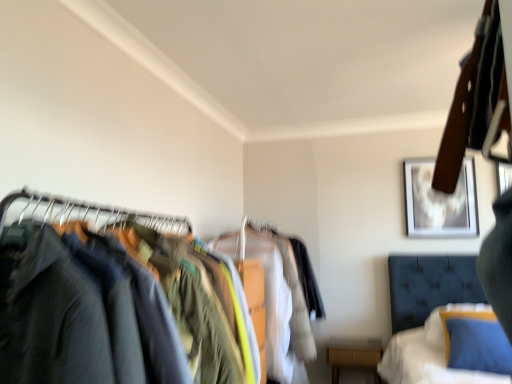
Where is `dark gray fabric at left, which is the second clothing from back to front`? Image resolution: width=512 pixels, height=384 pixels. dark gray fabric at left, which is the second clothing from back to front is located at coordinates (86, 317).

Where is `dark blue fabric at left`? This screenshot has height=384, width=512. dark blue fabric at left is located at coordinates (119, 300).

In the scene shown: Measure the distance between velvet blue bed at lower right and camera.

The depth of velvet blue bed at lower right is 2.08 meters.

Where is `metallic silver picture frame at upper right, the first picture frame viewed from the right`? The width and height of the screenshot is (512, 384). metallic silver picture frame at upper right, the first picture frame viewed from the right is located at coordinates (504, 177).

From a real-world perspective, who is located lower, metallic silver picture frame at upper right, positioned as the 2th picture frame in left-to-right order, or dark gray fabric at left, which is the 1th clothing in front-to-back order?

dark gray fabric at left, which is the 1th clothing in front-to-back order.

Considering the sizes of objects metallic silver picture frame at upper right, the first picture frame viewed from the right, and dark gray fabric at left, which is the second clothing from back to front, in the image provided, who is smaller, metallic silver picture frame at upper right, the first picture frame viewed from the right, or dark gray fabric at left, which is the second clothing from back to front,?

metallic silver picture frame at upper right, the first picture frame viewed from the right.

Is metallic silver picture frame at upper right, the first picture frame viewed from the right, positioned in front of dark gray fabric at left, which is the second clothing from back to front?

No.

Between metallic silver picture frame at upper right, the first picture frame viewed from the right, and dark gray fabric at left, which is the second clothing from back to front, which one appears on the right side from the viewer's perspective?

Positioned to the right is metallic silver picture frame at upper right, the first picture frame viewed from the right.

Is metallic silver picture frame at upper right, the first picture frame viewed from the right, facing towards white cotton shirt at center, the first clothing when ordered from back to front?

No, metallic silver picture frame at upper right, the first picture frame viewed from the right, is not facing towards white cotton shirt at center, the first clothing when ordered from back to front.

Which object is thinner, metallic silver picture frame at upper right, positioned as the 2th picture frame in left-to-right order, or white cotton shirt at center, the first clothing when ordered from back to front?

metallic silver picture frame at upper right, positioned as the 2th picture frame in left-to-right order, is thinner.

From the image's perspective, does metallic silver picture frame at upper right, the first picture frame viewed from the right, appear lower than white cotton shirt at center, acting as the 2th clothing starting from the front?

Actually, metallic silver picture frame at upper right, the first picture frame viewed from the right, appears above white cotton shirt at center, acting as the 2th clothing starting from the front, in the image.

Can you see metallic silver picture frame at upper right, positioned as the 2th picture frame in left-to-right order, touching white cotton shirt at center, acting as the 2th clothing starting from the front?

There is a gap between metallic silver picture frame at upper right, positioned as the 2th picture frame in left-to-right order, and white cotton shirt at center, acting as the 2th clothing starting from the front.

From the image's perspective, who appears lower, metallic silver picture frame at upper right, the first picture frame viewed from the right, or velvet blue bed at lower right?

velvet blue bed at lower right appears lower in the image.

This screenshot has height=384, width=512. What are the coordinates of `bed on the left of metallic silver picture frame at upper right, the first picture frame viewed from the right` in the screenshot? It's located at (426, 316).

Does metallic silver picture frame at upper right, the first picture frame viewed from the right, lie in front of velvet blue bed at lower right?

That is False.

Between metallic silver picture frame at upper right, the first picture frame viewed from the right, and velvet blue bed at lower right, which one has smaller width?

metallic silver picture frame at upper right, the first picture frame viewed from the right.

Could you measure the distance between velvet blue bed at lower right and white cotton shirt at center, acting as the 2th clothing starting from the front?

velvet blue bed at lower right and white cotton shirt at center, acting as the 2th clothing starting from the front, are 33.53 inches apart.

From the image's perspective, does velvet blue bed at lower right appear higher than white cotton shirt at center, acting as the 2th clothing starting from the front?

No.

Is point (386, 364) farther from viewer compared to point (249, 263)?

Yes, it is.

Which of these two, velvet blue bed at lower right or white cotton shirt at center, the first clothing when ordered from back to front, stands shorter?

Standing shorter between the two is velvet blue bed at lower right.

Is velvet blue bed at lower right in contact with dark gray fabric at left, which is the second clothing from back to front?

velvet blue bed at lower right is not next to dark gray fabric at left, which is the second clothing from back to front, and they're not touching.

Measure the distance between velvet blue bed at lower right and dark gray fabric at left, which is the second clothing from back to front.

The distance of velvet blue bed at lower right from dark gray fabric at left, which is the second clothing from back to front, is 6.40 feet.

From a real-world perspective, is velvet blue bed at lower right on top of dark gray fabric at left, which is the 1th clothing in front-to-back order?

No, from a real-world perspective, velvet blue bed at lower right is not over dark gray fabric at left, which is the 1th clothing in front-to-back order

In terms of size, does velvet blue bed at lower right appear bigger or smaller than dark gray fabric at left, which is the second clothing from back to front?

Clearly, velvet blue bed at lower right is larger in size than dark gray fabric at left, which is the second clothing from back to front.

From the image's perspective, relative to metallic silver picture frame at upper right, the first picture frame viewed from the right, is velvet blue bed at lower right above or below?

Based on their image positions, velvet blue bed at lower right is located beneath metallic silver picture frame at upper right, the first picture frame viewed from the right.

Would you say velvet blue bed at lower right is inside or outside metallic silver picture frame at upper right, positioned as the 2th picture frame in left-to-right order?

velvet blue bed at lower right is not inside metallic silver picture frame at upper right, positioned as the 2th picture frame in left-to-right order, it's outside.

Can you tell me how much velvet blue bed at lower right and metallic silver picture frame at upper right, the first picture frame viewed from the right, differ in facing direction?

There is a 3.01-degree angle between the facing directions of velvet blue bed at lower right and metallic silver picture frame at upper right, the first picture frame viewed from the right.

Considering the relative positions of velvet blue bed at lower right and metallic silver picture frame at upper right, positioned as the 2th picture frame in left-to-right order, in the image provided, is velvet blue bed at lower right to the left of metallic silver picture frame at upper right, positioned as the 2th picture frame in left-to-right order, from the viewer's perspective?

Yes.

Between dark blue fabric at left and velvet blue bed at lower right, which one appears on the left side from the viewer's perspective?

dark blue fabric at left is more to the left.

Based on the photo, measure the distance between dark blue fabric at left and velvet blue bed at lower right.

dark blue fabric at left is 4.06 feet away from velvet blue bed at lower right.

From a real-world perspective, is dark blue fabric at left positioned above or below velvet blue bed at lower right?

Clearly, from a real-world perspective, dark blue fabric at left is above velvet blue bed at lower right.

Based on the photo, could you tell me if dark blue fabric at left is facing velvet blue bed at lower right?

No, dark blue fabric at left is not turned towards velvet blue bed at lower right.

Find the location of a particular element. The width and height of the screenshot is (512, 384). the 2nd clothing to the left when counting from the metallic silver picture frame at upper right, the first picture frame viewed from the right is located at coordinates (86, 317).

Image resolution: width=512 pixels, height=384 pixels. Find the location of `clothing that is the 2nd object directly below the metallic silver picture frame at upper right, positioned as the 2th picture frame in left-to-right order (from a real-world perspective)`. clothing that is the 2nd object directly below the metallic silver picture frame at upper right, positioned as the 2th picture frame in left-to-right order (from a real-world perspective) is located at coordinates (274, 296).

Based on their spatial positions, is white cotton shirt at center, the first clothing when ordered from back to front, or dark gray fabric at left, which is the 1th clothing in front-to-back order, further from velvet blue bed at lower right?

dark gray fabric at left, which is the 1th clothing in front-to-back order, is positioned further to the anchor velvet blue bed at lower right.

Considering their positions, is velvet blue bed at lower right positioned further to white cotton shirt at center, acting as the 2th clothing starting from the front, than wooden framed artwork at upper right, which ranks as the 2th picture frame in right-to-left order?

Based on the image, wooden framed artwork at upper right, which ranks as the 2th picture frame in right-to-left order, appears to be further to white cotton shirt at center, acting as the 2th clothing starting from the front.

Considering their positions, is dark blue fabric at left positioned closer to metallic silver picture frame at upper right, the first picture frame viewed from the right, than dark gray fabric at left, which is the 1th clothing in front-to-back order?

Based on the image, dark gray fabric at left, which is the 1th clothing in front-to-back order, appears to be nearer to metallic silver picture frame at upper right, the first picture frame viewed from the right.

From the image, which object appears to be nearer to wooden framed artwork at upper right, marked as the 1th picture frame in a left-to-right arrangement, dark blue fabric at left or metallic silver picture frame at upper right, the first picture frame viewed from the right?

dark blue fabric at left.

Consider the image. Based on their spatial positions, is velvet blue bed at lower right or white cotton shirt at center, acting as the 2th clothing starting from the front, closer to dark blue fabric at left?

Based on the image, white cotton shirt at center, acting as the 2th clothing starting from the front, appears to be nearer to dark blue fabric at left.

From the image, which object appears to be farther from wooden framed artwork at upper right, marked as the 1th picture frame in a left-to-right arrangement, dark gray fabric at left, which is the second clothing from back to front, or white cotton shirt at center, acting as the 2th clothing starting from the front?

Among the two, dark gray fabric at left, which is the second clothing from back to front, is located further to wooden framed artwork at upper right, marked as the 1th picture frame in a left-to-right arrangement.

Which object lies nearer to the anchor point dark blue fabric at left, wooden framed artwork at upper right, marked as the 1th picture frame in a left-to-right arrangement, or white cotton shirt at center, acting as the 2th clothing starting from the front?

white cotton shirt at center, acting as the 2th clothing starting from the front, lies closer to dark blue fabric at left than the other object.

Which object lies further to the anchor point velvet blue bed at lower right, dark gray fabric at left, which is the second clothing from back to front, or metallic silver picture frame at upper right, the first picture frame viewed from the right?

Based on the image, dark gray fabric at left, which is the second clothing from back to front, appears to be further to velvet blue bed at lower right.

The image size is (512, 384). I want to click on bed between white cotton shirt at center, acting as the 2th clothing starting from the front, and metallic silver picture frame at upper right, the first picture frame viewed from the right, so click(x=426, y=316).

I want to click on clothing located between dark gray fabric at left, which is the second clothing from back to front, and metallic silver picture frame at upper right, the first picture frame viewed from the right, in the left-right direction, so click(x=274, y=296).

Locate an element on the screen. Image resolution: width=512 pixels, height=384 pixels. picture frame situated between dark gray fabric at left, which is the 1th clothing in front-to-back order, and metallic silver picture frame at upper right, positioned as the 2th picture frame in left-to-right order, from left to right is located at coordinates (439, 202).

Locate an element on the screen. clothing between dark gray fabric at left, which is the 1th clothing in front-to-back order, and wooden framed artwork at upper right, marked as the 1th picture frame in a left-to-right arrangement, from front to back is located at coordinates (274, 296).